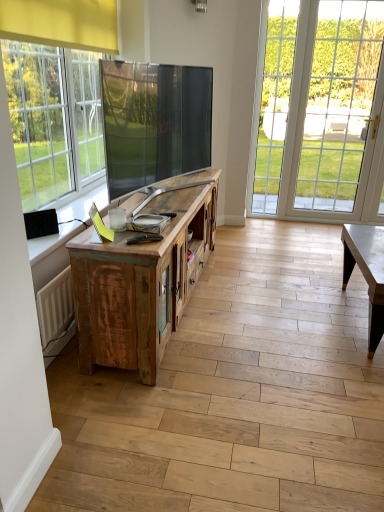
Question: From a real-world perspective, is clear glass door at right physically below weathered wood cabinet at center?

Choices:
 (A) yes
 (B) no

Answer: (B)

Question: From the image's perspective, is clear glass door at right located above weathered wood cabinet at center?

Choices:
 (A) yes
 (B) no

Answer: (A)

Question: From the image's perspective, does clear glass door at right appear lower than weathered wood cabinet at center?

Choices:
 (A) yes
 (B) no

Answer: (B)

Question: Considering the relative sizes of clear glass door at right and weathered wood cabinet at center in the image provided, is clear glass door at right taller than weathered wood cabinet at center?

Choices:
 (A) no
 (B) yes

Answer: (B)

Question: Is clear glass door at right to the left of weathered wood cabinet at center from the viewer's perspective?

Choices:
 (A) yes
 (B) no

Answer: (B)

Question: Is clear glass door at right positioned with its back to weathered wood cabinet at center?

Choices:
 (A) yes
 (B) no

Answer: (B)

Question: From a real-world perspective, is weathered wood cabinet at center physically below clear glass door at right?

Choices:
 (A) yes
 (B) no

Answer: (A)

Question: Is clear glass door at right inside weathered wood cabinet at center?

Choices:
 (A) no
 (B) yes

Answer: (A)

Question: Is weathered wood cabinet at center far from clear glass door at right?

Choices:
 (A) no
 (B) yes

Answer: (B)

Question: Considering the relative sizes of weathered wood cabinet at center and clear glass door at right in the image provided, is weathered wood cabinet at center smaller than clear glass door at right?

Choices:
 (A) no
 (B) yes

Answer: (A)

Question: Is the position of weathered wood cabinet at center more distant than that of clear glass door at right?

Choices:
 (A) yes
 (B) no

Answer: (B)

Question: From the image's perspective, is weathered wood cabinet at center below clear glass door at right?

Choices:
 (A) no
 (B) yes

Answer: (B)

Question: Relative to weathered wood cabinet at center, is clear glass door at right in front or behind?

Choices:
 (A) behind
 (B) front

Answer: (A)